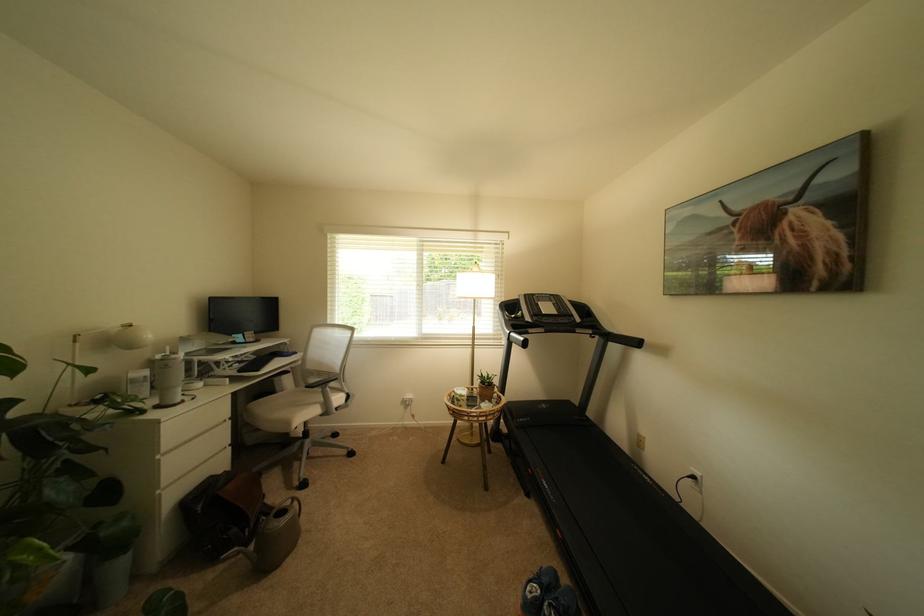
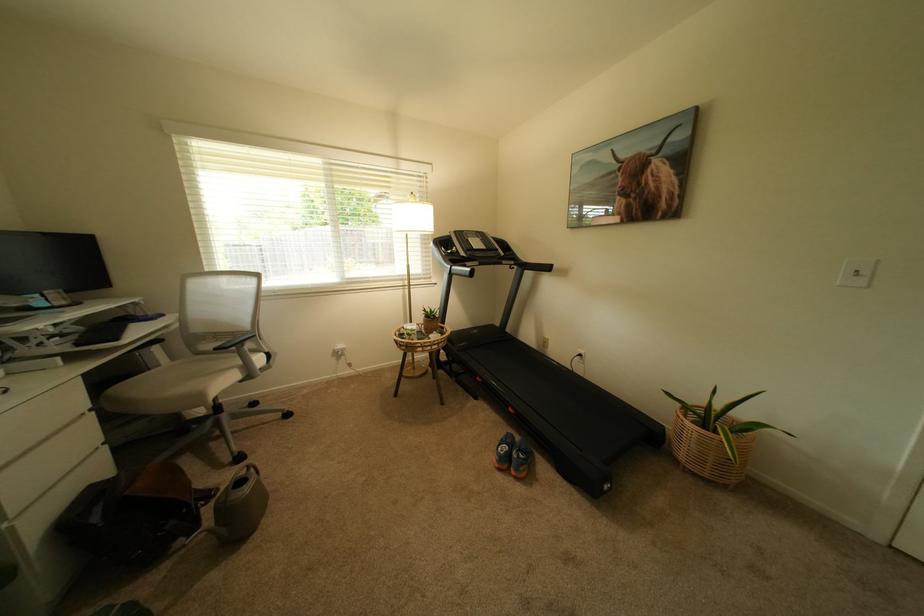
Locate, in the second image, the point that corresponds to [612,341] in the first image.

(529, 270)